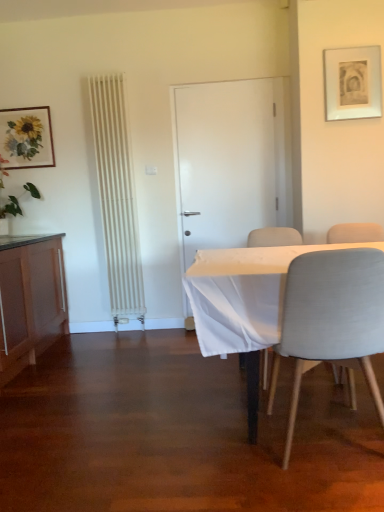
Identify the location of light gray fabric chair at lower right, the third chair positioned from the back. (331, 318).

I want to click on light gray fabric chair at center, which ranks as the first chair in back-to-front order, so click(274, 237).

Describe the element at coordinates (26, 137) in the screenshot. I see `matte wooden picture frame at upper left, the 1th picture frame when ordered from back to front` at that location.

Describe the element at coordinates (229, 161) in the screenshot. I see `white matte door at center` at that location.

What is the approximate height of matte white picture frame at upper right, which appears as the second picture frame when viewed from the back?

matte white picture frame at upper right, which appears as the second picture frame when viewed from the back, is 20.30 inches in height.

Image resolution: width=384 pixels, height=512 pixels. I want to click on light gray fabric chair at lower right, the 1th chair in the front-to-back sequence, so click(331, 318).

Would you say light gray fabric chair at right, the second chair positioned from the back, is a long distance from light gray fabric chair at center, which ranks as the first chair in back-to-front order?

No, light gray fabric chair at right, the second chair positioned from the back, is in close proximity to light gray fabric chair at center, which ranks as the first chair in back-to-front order.

Can you confirm if light gray fabric chair at right, arranged as the second chair when viewed from the front, is bigger than light gray fabric chair at center, which ranks as the first chair in back-to-front order?

Actually, light gray fabric chair at right, arranged as the second chair when viewed from the front, might be smaller than light gray fabric chair at center, which ranks as the first chair in back-to-front order.

Is point (367, 227) in front of point (263, 384)?

No.

Which object is positioned more to the left, light gray fabric chair at right, arranged as the second chair when viewed from the front, or light gray fabric chair at center, the third chair in the front-to-back sequence?

From the viewer's perspective, light gray fabric chair at center, the third chair in the front-to-back sequence, appears more on the left side.

Between point (339, 53) and point (10, 167), which one is positioned behind?

Positioned behind is point (10, 167).

Between matte white picture frame at upper right, marked as the first picture frame in a front-to-back arrangement, and matte wooden picture frame at upper left, the 1th picture frame when ordered from back to front, which one appears on the left side from the viewer's perspective?

matte wooden picture frame at upper left, the 1th picture frame when ordered from back to front, is more to the left.

Is matte wooden picture frame at upper left, the 2th picture frame positioned from the right, completely or partially inside matte white picture frame at upper right, which appears as the second picture frame when viewed from the back?

Actually, matte wooden picture frame at upper left, the 2th picture frame positioned from the right, is outside matte white picture frame at upper right, which appears as the second picture frame when viewed from the back.

Between matte white picture frame at upper right, which ranks as the 1th picture frame in right-to-left order, and matte wooden picture frame at upper left, the 2th picture frame positioned from the right, which one has smaller width?

Thinner between the two is matte wooden picture frame at upper left, the 2th picture frame positioned from the right.

From a real-world perspective, is light gray fabric chair at center, the third chair in the front-to-back sequence, on top of green leafy plant at left?

Actually, light gray fabric chair at center, the third chair in the front-to-back sequence, is physically below green leafy plant at left in the real world.

From the image's perspective, is light gray fabric chair at center, which ranks as the first chair in back-to-front order, under green leafy plant at left?

Yes.

The image size is (384, 512). In order to click on the 2nd chair counting from the right side of the green leafy plant at left in this screenshot , I will do `click(274, 237)`.

Does point (261, 237) come behind point (34, 190)?

No, (261, 237) is in front of (34, 190).

Is green leafy plant at left at the right side of matte wood cabinet at left?

Incorrect, green leafy plant at left is not on the right side of matte wood cabinet at left.

From a real-world perspective, which is physically below, green leafy plant at left or matte wood cabinet at left?

matte wood cabinet at left is physically lower.

Identify the location of cabinetry in front of the green leafy plant at left. This screenshot has width=384, height=512. (30, 302).

Is green leafy plant at left smaller than matte wood cabinet at left?

Yes.

Could you measure the distance between white matte door at center and matte white picture frame at upper right, which ranks as the 1th picture frame in right-to-left order?

The distance of white matte door at center from matte white picture frame at upper right, which ranks as the 1th picture frame in right-to-left order, is 30.91 inches.

Is white matte door at center taller or shorter than matte white picture frame at upper right, marked as the first picture frame in a front-to-back arrangement?

white matte door at center is taller than matte white picture frame at upper right, marked as the first picture frame in a front-to-back arrangement.

Is white matte door at center facing away from matte white picture frame at upper right, which ranks as the 1th picture frame in right-to-left order?

No, matte white picture frame at upper right, which ranks as the 1th picture frame in right-to-left order, is not at the back of white matte door at center.

From a real-world perspective, between white matte door at center and matte white picture frame at upper right, which ranks as the 1th picture frame in right-to-left order, who is vertically higher?

From a 3D spatial view, matte white picture frame at upper right, which ranks as the 1th picture frame in right-to-left order, is above.

Considering the points (27, 362) and (272, 241), which point is in front, point (27, 362) or point (272, 241)?

The point (272, 241) is closer.

In the scene shown: How distant is matte wood cabinet at left from light gray fabric chair at center, the third chair in the front-to-back sequence?

matte wood cabinet at left and light gray fabric chair at center, the third chair in the front-to-back sequence, are 1.66 meters apart.

Does matte wood cabinet at left have a larger size compared to light gray fabric chair at center, the third chair in the front-to-back sequence?

Correct, matte wood cabinet at left is larger in size than light gray fabric chair at center, the third chair in the front-to-back sequence.

Is matte wood cabinet at left located outside light gray fabric chair at center, the third chair in the front-to-back sequence?

matte wood cabinet at left lies outside light gray fabric chair at center, the third chair in the front-to-back sequence,'s area.

In terms of size, does green leafy plant at left appear bigger or smaller than white matte door at center?

Considering their sizes, green leafy plant at left takes up more space than white matte door at center.

Considering the positions of point (4, 209) and point (202, 167), is point (4, 209) closer or farther from the camera than point (202, 167)?

Point (4, 209) appears to be farther away from the viewer than point (202, 167).

In the scene shown: Can you confirm if green leafy plant at left is positioned to the right of white matte door at center?

Incorrect, green leafy plant at left is not on the right side of white matte door at center.

Where is `chair above the light gray fabric chair at center, the third chair in the front-to-back sequence (from the image's perspective)`? The width and height of the screenshot is (384, 512). chair above the light gray fabric chair at center, the third chair in the front-to-back sequence (from the image's perspective) is located at coordinates (355, 233).

You are a GUI agent. You are given a task and a screenshot of the screen. Output one action in this format:
    pyautogui.click(x=<x>, y=<y>)
    Task: Click on the picture frame below the matte white picture frame at upper right, which ranks as the 1th picture frame in right-to-left order (from a real-world perspective)
    The image size is (384, 512).
    Given the screenshot: What is the action you would take?
    pyautogui.click(x=26, y=137)

Which object lies further to the anchor point green leafy plant at left, light gray fabric chair at center, the third chair in the front-to-back sequence, or light gray fabric chair at right, arranged as the second chair when viewed from the front?

light gray fabric chair at right, arranged as the second chair when viewed from the front, is positioned further to the anchor green leafy plant at left.

Looking at the image, which one is located closer to light gray fabric chair at right, the second chair positioned from the back, light gray fabric chair at center, which ranks as the first chair in back-to-front order, or light gray fabric chair at lower right, the third chair positioned from the back?

light gray fabric chair at center, which ranks as the first chair in back-to-front order, is closer to light gray fabric chair at right, the second chair positioned from the back.

Estimate the real-world distances between objects in this image. Which object is further from light gray fabric chair at right, the second chair positioned from the back, matte wood cabinet at left or matte white picture frame at upper right, which ranks as the 1th picture frame in right-to-left order?

The object further to light gray fabric chair at right, the second chair positioned from the back, is matte wood cabinet at left.

Based on their spatial positions, is green leafy plant at left or light gray fabric chair at lower right, the third chair positioned from the back, further from light gray fabric chair at center, the third chair in the front-to-back sequence?

green leafy plant at left lies further to light gray fabric chair at center, the third chair in the front-to-back sequence, than the other object.

Looking at the image, which one is located further to green leafy plant at left, matte white picture frame at upper right, marked as the first picture frame in a front-to-back arrangement, or matte wooden picture frame at upper left, the 1th picture frame when ordered from back to front?

matte white picture frame at upper right, marked as the first picture frame in a front-to-back arrangement.

From the image, which object appears to be farther from white matte door at center, matte wooden picture frame at upper left, arranged as the 2th picture frame when viewed from the front, or light gray fabric chair at right, arranged as the second chair when viewed from the front?

Among the two, matte wooden picture frame at upper left, arranged as the 2th picture frame when viewed from the front, is located further to white matte door at center.

Based on their spatial positions, is light gray fabric chair at center, which ranks as the first chair in back-to-front order, or matte wooden picture frame at upper left, the 1th picture frame when ordered from back to front, further from green leafy plant at left?

The object further to green leafy plant at left is light gray fabric chair at center, which ranks as the first chair in back-to-front order.

When comparing their distances from white matte door at center, does light gray fabric chair at center, the third chair in the front-to-back sequence, or green leafy plant at left seem closer?

light gray fabric chair at center, the third chair in the front-to-back sequence.

The width and height of the screenshot is (384, 512). In order to click on picture frame situated between green leafy plant at left and light gray fabric chair at center, the third chair in the front-to-back sequence, from left to right in this screenshot , I will do coord(26,137).

At what (x,y) coordinates should I click in order to perform the action: click on door between matte wooden picture frame at upper left, arranged as the 2th picture frame when viewed from the front, and light gray fabric chair at center, which ranks as the first chair in back-to-front order. Please return your answer as a coordinate pair (x, y). This screenshot has width=384, height=512. Looking at the image, I should click on (229, 161).

At what (x,y) coordinates should I click in order to perform the action: click on picture frame between green leafy plant at left and white matte door at center from left to right. Please return your answer as a coordinate pair (x, y). The image size is (384, 512). Looking at the image, I should click on (26, 137).

This screenshot has height=512, width=384. What are the coordinates of `cabinetry between matte wooden picture frame at upper left, the 1th picture frame when ordered from back to front, and matte white picture frame at upper right, the 2th picture frame in the left-to-right sequence, from left to right` in the screenshot? It's located at (30, 302).